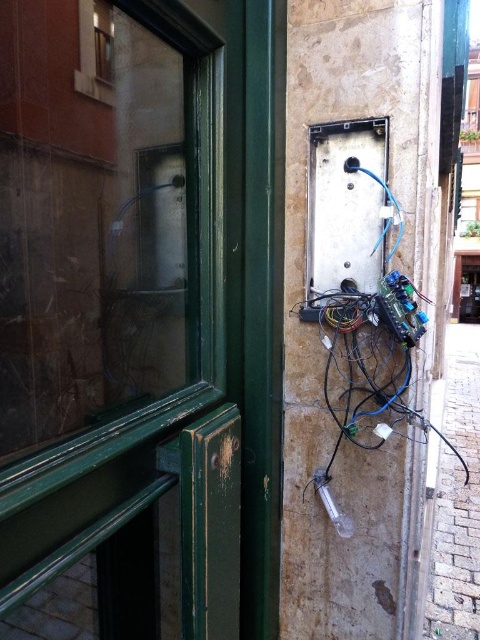
You are a technician trying to access the metallic gray electrical box at center. There are black plastic wires at lower right in the way. Can you move the wires to reach the box?

The black plastic wires at lower right are positioned under the metallic gray electrical box at center, so you can move them to access the box.

You are an electrician inspecting the exterior wall. You notice the black plastic wires at lower right and the metallic gray electrical box at center. Which object is smaller in size?

The black plastic wires at lower right is smaller than the metallic gray electrical box at center.